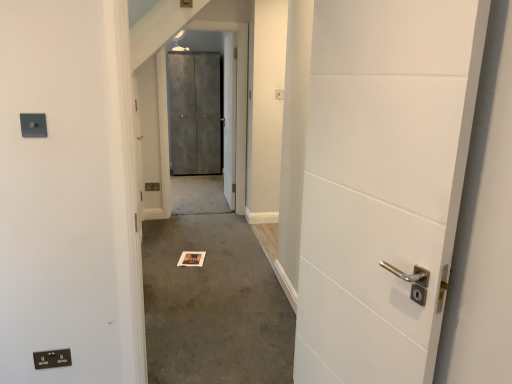
Question: From the image's perspective, does metallic gray elevator door at center appear lower than matte gray electric outlet at upper left, which is the 1th electric outlet from top to bottom?

Choices:
 (A) no
 (B) yes

Answer: (A)

Question: Is metallic gray elevator door at center positioned far away from matte gray electric outlet at upper left, which is the 1th electric outlet from top to bottom?

Choices:
 (A) no
 (B) yes

Answer: (B)

Question: Considering the relative sizes of metallic gray elevator door at center and matte gray electric outlet at upper left, the 2th electric outlet in the back-to-front sequence, in the image provided, is metallic gray elevator door at center wider than matte gray electric outlet at upper left, the 2th electric outlet in the back-to-front sequence,?

Choices:
 (A) yes
 (B) no

Answer: (A)

Question: Does metallic gray elevator door at center have a smaller size compared to matte gray electric outlet at upper left, the 2th electric outlet in the back-to-front sequence?

Choices:
 (A) yes
 (B) no

Answer: (B)

Question: Does metallic gray elevator door at center appear on the left side of matte gray electric outlet at upper left, arranged as the 2th electric outlet when ordered from the bottom?

Choices:
 (A) no
 (B) yes

Answer: (A)

Question: From a real-world perspective, does metallic gray elevator door at center sit lower than matte gray electric outlet at upper left, the 1th electric outlet positioned from the front?

Choices:
 (A) yes
 (B) no

Answer: (A)

Question: Can you confirm if carpeted floor at center is thinner than black plastic electric outlet at lower left, which ranks as the 2th electric outlet in front-to-back order?

Choices:
 (A) no
 (B) yes

Answer: (A)

Question: Is carpeted floor at center facing away from black plastic electric outlet at lower left, the first electric outlet when ordered from back to front?

Choices:
 (A) yes
 (B) no

Answer: (B)

Question: Considering the relative positions of carpeted floor at center and black plastic electric outlet at lower left, marked as the 2th electric outlet in a top-to-bottom arrangement, in the image provided, is carpeted floor at center to the right of black plastic electric outlet at lower left, marked as the 2th electric outlet in a top-to-bottom arrangement, from the viewer's perspective?

Choices:
 (A) no
 (B) yes

Answer: (B)

Question: From a real-world perspective, is carpeted floor at center physically below black plastic electric outlet at lower left, marked as the 2th electric outlet in a top-to-bottom arrangement?

Choices:
 (A) no
 (B) yes

Answer: (A)

Question: Can you confirm if carpeted floor at center is shorter than black plastic electric outlet at lower left, marked as the 2th electric outlet in a top-to-bottom arrangement?

Choices:
 (A) no
 (B) yes

Answer: (A)

Question: Is the position of carpeted floor at center more distant than that of black plastic electric outlet at lower left, marked as the 1th electric outlet in a bottom-to-top arrangement?

Choices:
 (A) yes
 (B) no

Answer: (B)

Question: Can you confirm if black plastic electric outlet at lower left, which ranks as the 2th electric outlet in front-to-back order, is positioned to the right of matte gray electric outlet at upper left, arranged as the 2th electric outlet when ordered from the bottom?

Choices:
 (A) yes
 (B) no

Answer: (B)